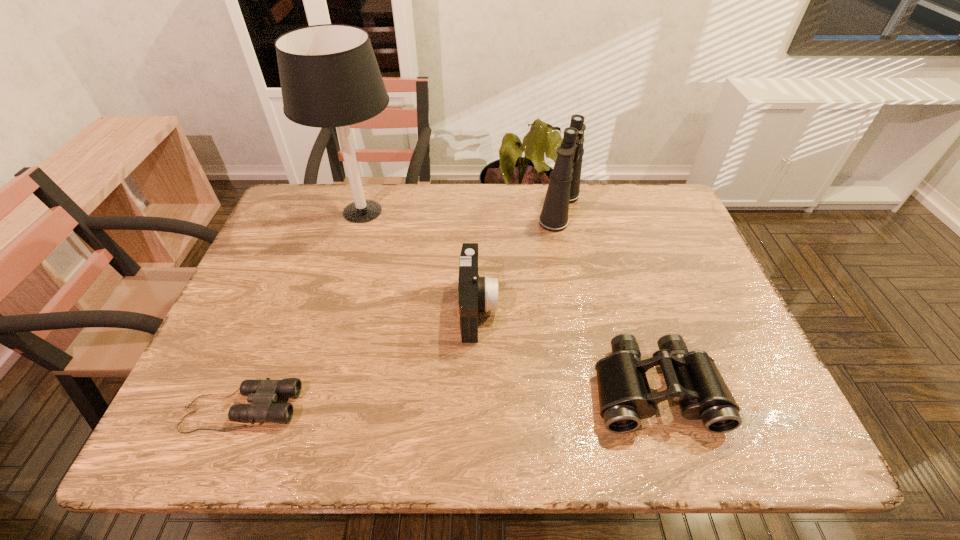
What are the coordinates of `vacant region at the far edge of the desktop` in the screenshot? It's located at (536, 204).

At what (x,y) coordinates should I click in order to perform the action: click on free point at the near edge. Please return your answer as a coordinate pair (x, y). Looking at the image, I should click on 497,446.

Where is `vacant space at the left edge of the desktop`? The height and width of the screenshot is (540, 960). vacant space at the left edge of the desktop is located at coordinates (251, 295).

In order to click on free space at the right edge in this screenshot , I will do `click(740, 340)`.

The width and height of the screenshot is (960, 540). I want to click on vacant space at the far right corner of the desktop, so click(x=635, y=220).

Locate an element on the screen. vacant space at the near right corner of the desktop is located at coordinates (757, 450).

Find the location of a particular element. This screenshot has height=540, width=960. free spot between the table lamp and the second tallest binoculars is located at coordinates (509, 300).

I want to click on free space between the third farthest object and the tallest binoculars, so click(518, 259).

At what (x,y) coordinates should I click in order to perform the action: click on free space between the third object from right to left and the second shortest object. Please return your answer as a coordinate pair (x, y). Looking at the image, I should click on (566, 348).

The image size is (960, 540). I want to click on free space between the tallest object and the third nearest object, so click(x=420, y=260).